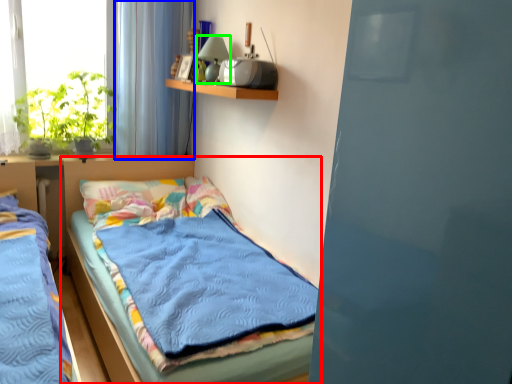
Question: Which object is positioned farthest from bed (highlighted by a red box)? Select from curtain (highlighted by a blue box) and lamp (highlighted by a green box).

Choices:
 (A) curtain
 (B) lamp

Answer: (B)